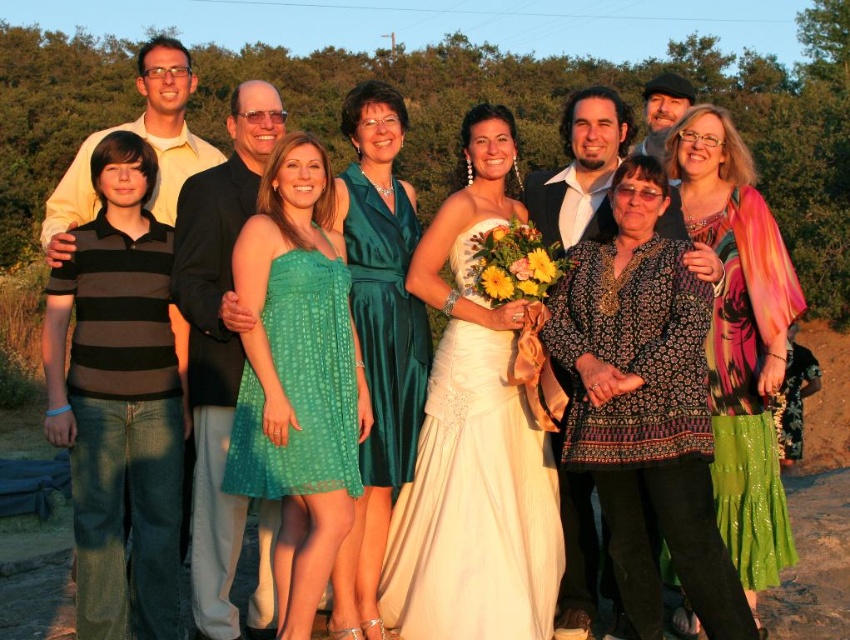
Question: Does multicolored silk dress at center appear over black satin suit at center?

Choices:
 (A) yes
 (B) no

Answer: (A)

Question: Does multicolored silk dress at center come in front of green satin dress at center?

Choices:
 (A) yes
 (B) no

Answer: (A)

Question: Which object appears farthest from the camera in this image?

Choices:
 (A) black textured hat at upper right
 (B) green satin dress at center
 (C) matte black shirt at center

Answer: (A)

Question: Is green dotted dress at center wider than green dotted fabric dress at center?

Choices:
 (A) no
 (B) yes

Answer: (B)

Question: Which of the following is the farthest from the observer?

Choices:
 (A) white satin dress at center
 (B) emerald satin dress at center
 (C) black satin suit at center
 (D) striped cotton shirt at left

Answer: (B)

Question: Among these points, which one is farthest from the camera?

Choices:
 (A) (661, 122)
 (B) (429, 584)
 (C) (607, 561)
 (D) (411, 305)

Answer: (A)